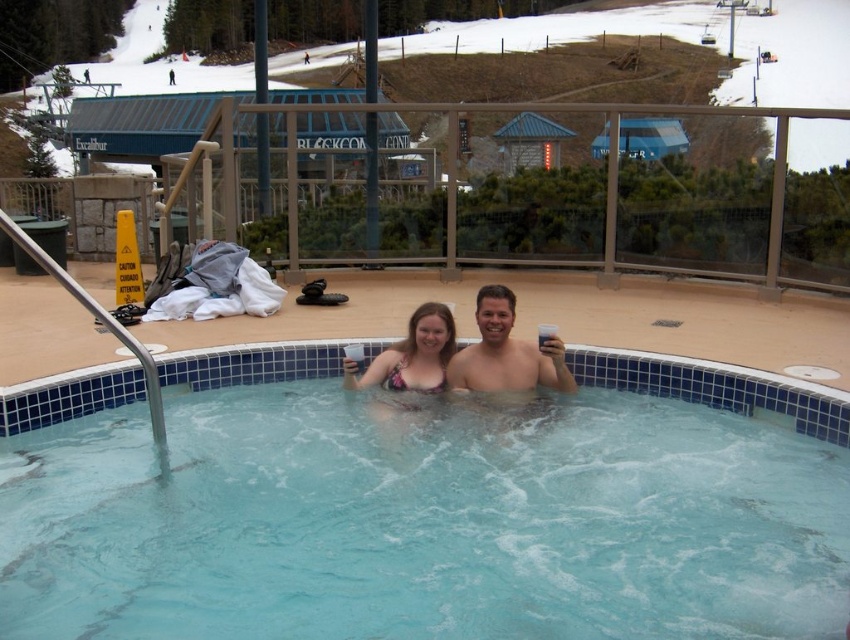
Is clear plastic cups at center positioned in front of smooth skin man at center?

That is True.

Based on the photo, can you confirm if clear plastic cups at center is shorter than smooth skin man at center?

In fact, clear plastic cups at center may be taller than smooth skin man at center.

Locate an element on the screen. clear plastic cups at center is located at coordinates (466, 355).

Which of these two, blue tile swimming pool at center or patterned bikini top at center, stands taller?

With more height is blue tile swimming pool at center.

Which is behind, point (636, 547) or point (416, 392)?

Point (416, 392)

Where is `blue tile swimming pool at center`? This screenshot has height=640, width=850. blue tile swimming pool at center is located at coordinates (423, 506).

Is blue tile swimming pool at center bigger than clear plastic cups at center?

Yes, blue tile swimming pool at center is bigger than clear plastic cups at center.

Is blue tile swimming pool at center positioned in front of clear plastic cups at center?

Yes.

This screenshot has height=640, width=850. Identify the location of blue tile swimming pool at center. (423, 506).